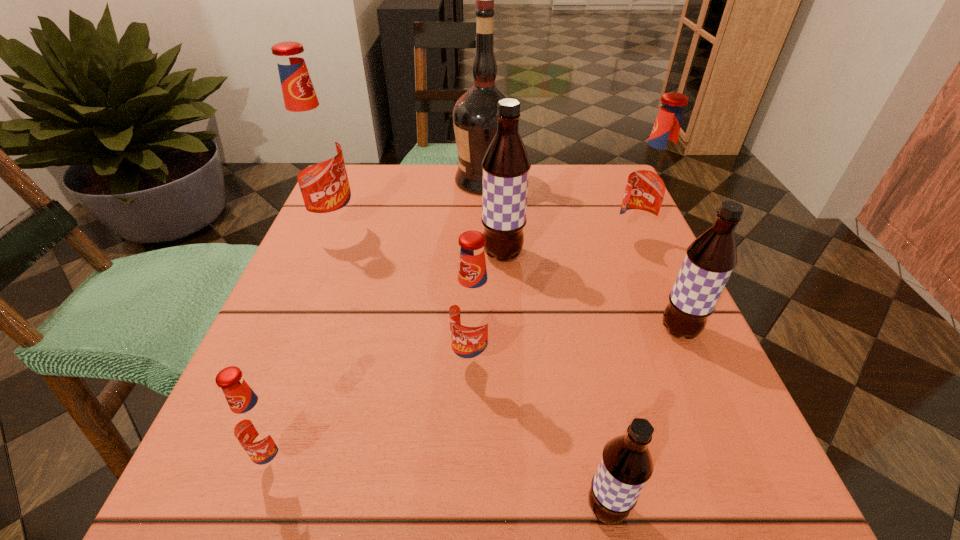
Locate an element on the screen. This screenshot has width=960, height=540. the nearest red root beer is located at coordinates (257, 424).

Where is `the second brown root beer from left to right`? the second brown root beer from left to right is located at coordinates (x=626, y=464).

Where is `the sixth object from left to right`? The width and height of the screenshot is (960, 540). the sixth object from left to right is located at coordinates (626, 464).

You are a GUI agent. You are given a task and a screenshot of the screen. Output one action in this format:
    pyautogui.click(x=<x>, y=<y>)
    Task: Click on the vacant space positioned on the surface of the farthest object
    The height and width of the screenshot is (540, 960).
    Given the screenshot: What is the action you would take?
    pyautogui.click(x=369, y=181)

Identify the location of free space located 0.190m on the surface of the farthest object. Image resolution: width=960 pixels, height=540 pixels. (377, 181).

The width and height of the screenshot is (960, 540). What are the coordinates of `free space located 0.230m on the surface of the farthest object` in the screenshot? It's located at (361, 181).

Identify the location of vacant space positioned 0.160m on the back of the tallest root beer. (355, 178).

Find the location of a particular element. free region located on the front of the rightmost red root beer is located at coordinates (658, 302).

The image size is (960, 540). What are the coordinates of `vacant space situated 0.120m on the right of the farthest brown root beer` in the screenshot? It's located at (585, 254).

I want to click on vacant space located on the left of the second smallest brown root beer, so click(597, 330).